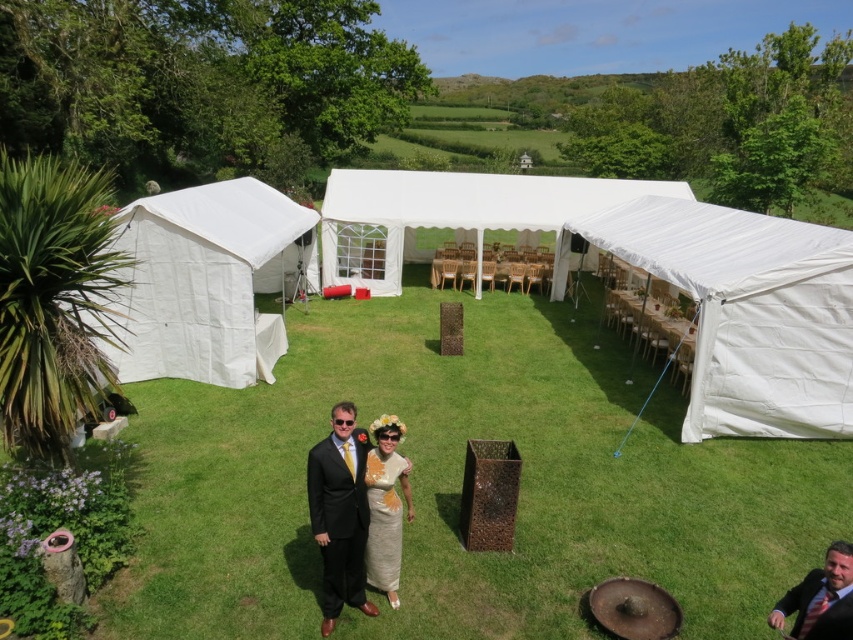
Question: Which point is closer to the camera taking this photo?

Choices:
 (A) (482, 198)
 (B) (390, 397)
 (C) (364, 483)

Answer: (C)

Question: Which object appears closest to the camera in this image?

Choices:
 (A) matte black suit at center
 (B) beige floral dress at center

Answer: (A)

Question: Is white canvas tent at left positioned at the back of smooth brown suit at lower right?

Choices:
 (A) no
 (B) yes

Answer: (B)

Question: In this image, where is white canvas tent at left located relative to white fabric canopy at center?

Choices:
 (A) right
 (B) left

Answer: (B)

Question: Which of the following is the farthest from the observer?

Choices:
 (A) (715, 314)
 (B) (350, 579)

Answer: (A)

Question: Where is matte black suit at center located in relation to smooth brown suit at lower right in the image?

Choices:
 (A) right
 (B) left

Answer: (B)